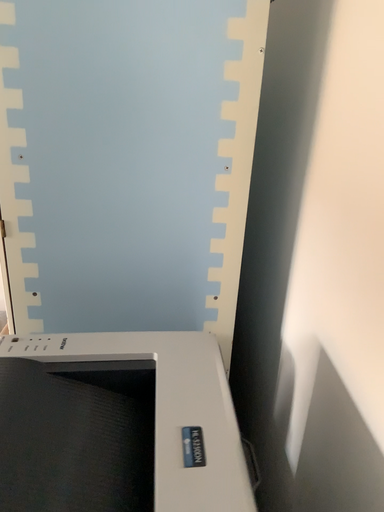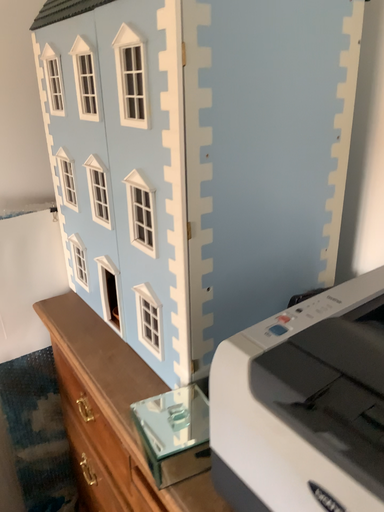
Question: Which way did the camera rotate in the video?

Choices:
 (A) rotated left
 (B) rotated right

Answer: (B)